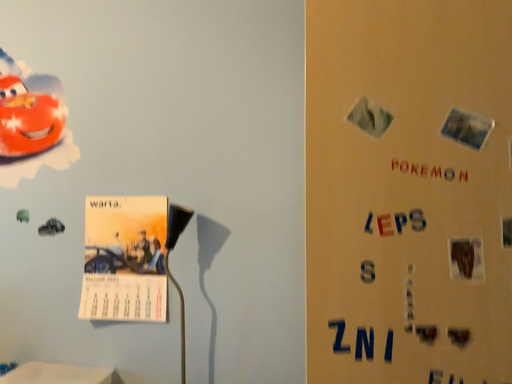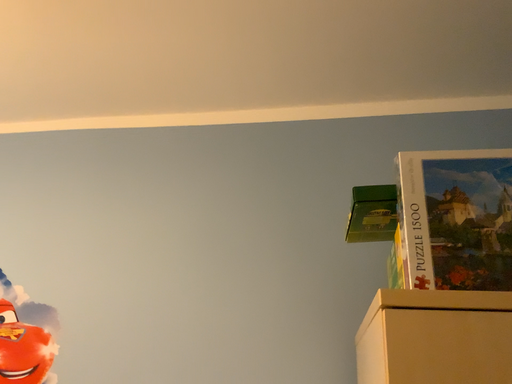
Question: Which way did the camera rotate in the video?

Choices:
 (A) rotated downward
 (B) rotated upward

Answer: (B)